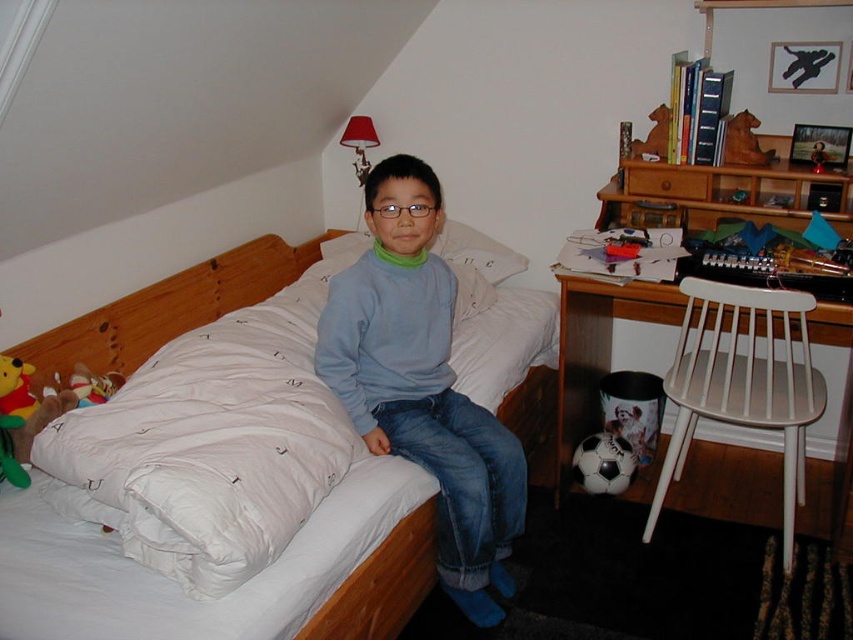
You are a parent trying to decide where to place a new nightstand. You see the white soft bed at center and the white soft pillow at center in the room. Which object takes up more space in the room?

The white soft bed at center takes up more space in the room because it is bigger than the white soft pillow at center.

You are a parent trying to choose a seat for your child to read bedtime stories. You have two options in the room shown in the image. The first option is the white wood chair at right, and the second is the soft plush bear at bed left. Considering the height, which one would be more suitable for your child to sit on comfortably?

The white wood chair at right is much taller than the soft plush bear at bed left, so the white wood chair at right would be more suitable for the child to sit on comfortably as it provides a proper seating height.